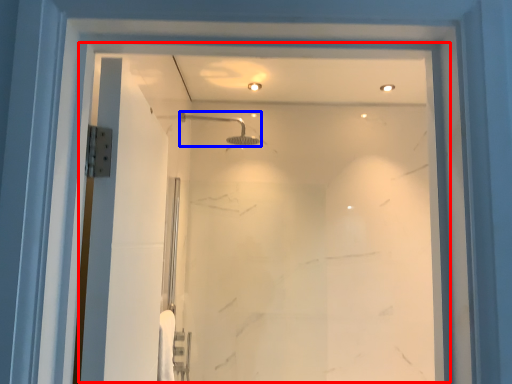
Question: Among these objects, which one is farthest to the camera, glass door (highlighted by a red box) or shower (highlighted by a blue box)?

Choices:
 (A) glass door
 (B) shower

Answer: (B)